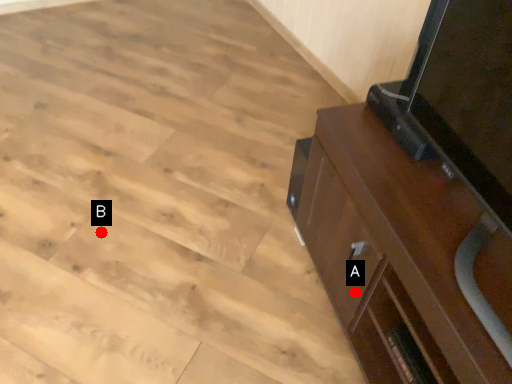
Question: Two points are circled on the image, labeled by A and B beside each circle. Which point is farther from the camera taking this photo?

Choices:
 (A) A is further
 (B) B is further

Answer: (B)